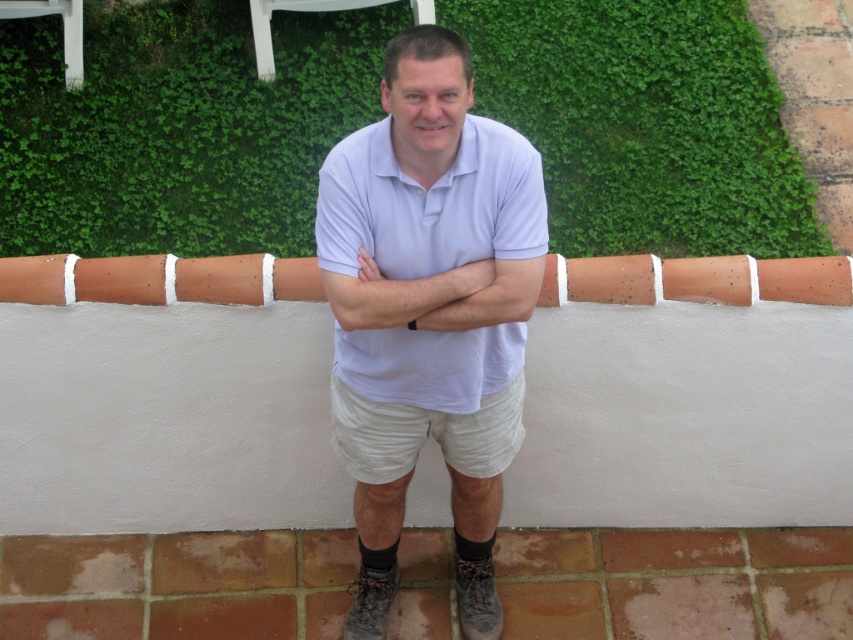
You are a photographer setting up a shot of the man in the scene. You notice the light blue cotton polo shirt at center and the beige cotton shorts at center. Which clothing item will appear larger in your photo?

The light blue cotton polo shirt at center will appear larger in the photo because it is closer to the viewer than the beige cotton shorts at center.

You are standing at the point closest to the camera. Which of the two points, point (207, 70) or point (389, 451), is farther away from you?

Point (207, 70) is behind point (389, 451), so it is farther away from you.